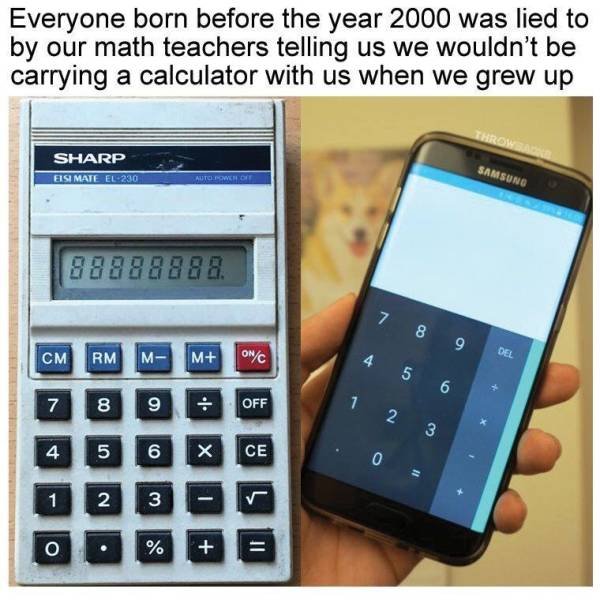
Where is `wall`? The width and height of the screenshot is (600, 600). wall is located at coordinates (561, 549).